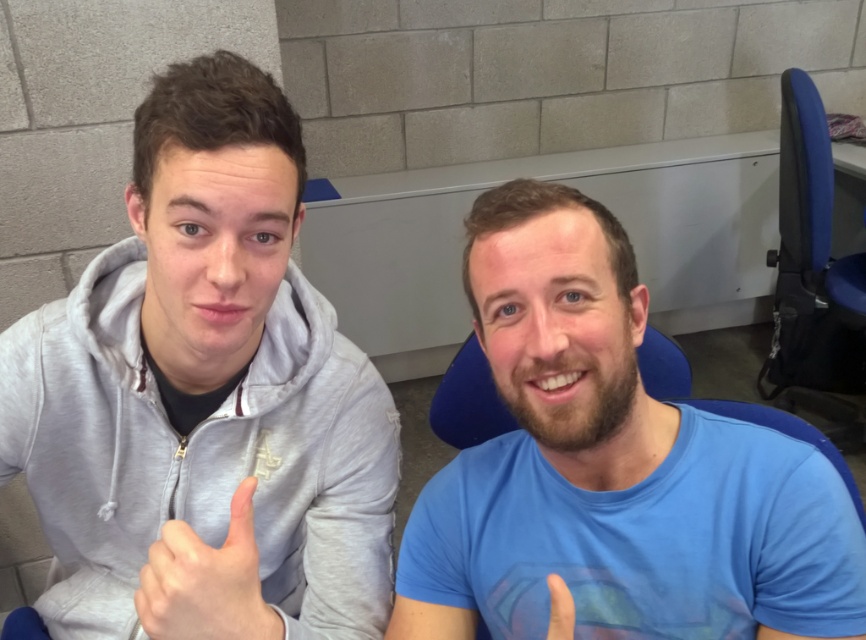
How much distance is there between matte gray hoodie at left and matte gray hand at center?

matte gray hoodie at left and matte gray hand at center are 9.64 inches apart.

Image resolution: width=866 pixels, height=640 pixels. What are the coordinates of `matte gray hoodie at left` in the screenshot? It's located at (204, 397).

Does blue matte shirt at center have a greater width compared to matte gray hand at center?

Correct, the width of blue matte shirt at center exceeds that of matte gray hand at center.

Which is in front, point (561, 369) or point (172, 618)?

Positioned in front is point (172, 618).

The width and height of the screenshot is (866, 640). In order to click on blue matte shirt at center in this screenshot , I will do `click(611, 467)`.

Is point (289, 324) less distant than point (561, 300)?

That is False.

This screenshot has height=640, width=866. Find the location of `matte gray hoodie at left`. matte gray hoodie at left is located at coordinates (204, 397).

Find the location of a particular element. matte gray hoodie at left is located at coordinates (204, 397).